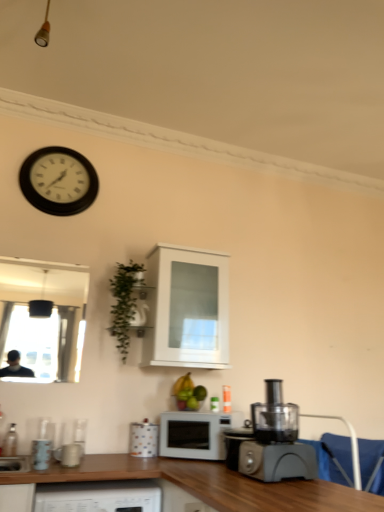
Question: Can you confirm if matte ceramic mug at lower left, the second appliance from the back, is taller than green leafy plant at upper left?

Choices:
 (A) yes
 (B) no

Answer: (B)

Question: Considering the relative sizes of matte ceramic mug at lower left, the 1th appliance viewed from the left, and green leafy plant at upper left in the image provided, is matte ceramic mug at lower left, the 1th appliance viewed from the left, bigger than green leafy plant at upper left?

Choices:
 (A) no
 (B) yes

Answer: (A)

Question: Is matte ceramic mug at lower left, the 2th appliance in the right-to-left sequence, further to camera compared to green leafy plant at upper left?

Choices:
 (A) yes
 (B) no

Answer: (B)

Question: Can we say matte ceramic mug at lower left, the second appliance from the back, lies outside green leafy plant at upper left?

Choices:
 (A) yes
 (B) no

Answer: (A)

Question: Is matte ceramic mug at lower left, the 1th appliance viewed from the left, positioned with its back to green leafy plant at upper left?

Choices:
 (A) yes
 (B) no

Answer: (B)

Question: Does point (6, 452) appear closer or farther from the camera than point (236, 423)?

Choices:
 (A) farther
 (B) closer

Answer: (A)

Question: Based on their sizes in the image, would you say clear glass bottle at lower left is bigger or smaller than white matte microwave at center?

Choices:
 (A) small
 (B) big

Answer: (A)

Question: From a real-world perspective, is clear glass bottle at lower left physically located above or below white matte microwave at center?

Choices:
 (A) above
 (B) below

Answer: (B)

Question: In terms of height, does clear glass bottle at lower left look taller or shorter compared to white matte microwave at center?

Choices:
 (A) short
 (B) tall

Answer: (A)

Question: Is white matte microwave at center inside or outside of white glossy cabinet at upper center?

Choices:
 (A) outside
 (B) inside

Answer: (A)

Question: Is point (193, 415) positioned closer to the camera than point (165, 285)?

Choices:
 (A) farther
 (B) closer

Answer: (B)

Question: In the image, is white matte microwave at center positioned in front of or behind white glossy cabinet at upper center?

Choices:
 (A) front
 (B) behind

Answer: (A)

Question: Is white matte microwave at center to the left or to the right of white glossy cabinet at upper center in the image?

Choices:
 (A) left
 (B) right

Answer: (B)

Question: Is blue fabric armchair at lower right wider or thinner than matte ceramic mug at lower left, the 1th appliance viewed from the left?

Choices:
 (A) wide
 (B) thin

Answer: (A)

Question: Is blue fabric armchair at lower right inside or outside of matte ceramic mug at lower left, the 1th appliance viewed from the left?

Choices:
 (A) outside
 (B) inside

Answer: (A)